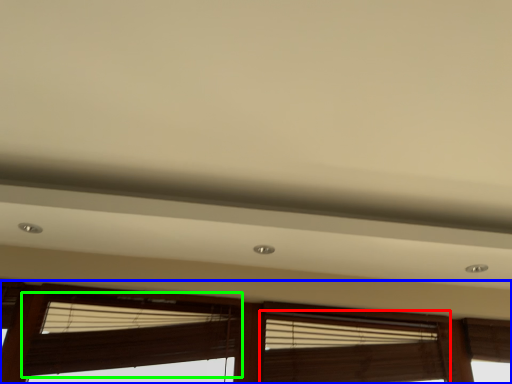
Question: Estimate the real-world distances between objects in this image. Which object is farther from window blind (highlighted by a red box), window (highlighted by a blue box) or window blind (highlighted by a green box)?

Choices:
 (A) window
 (B) window blind

Answer: (B)